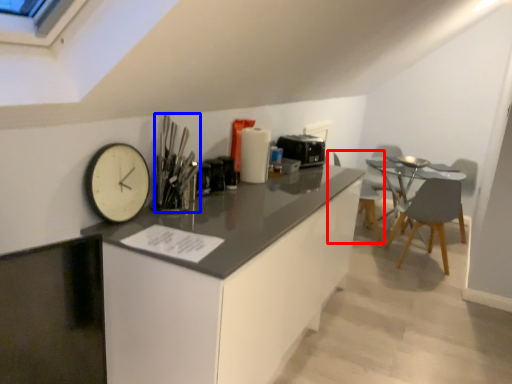
Question: Which object is further to the camera taking this photo, chair (highlighted by a red box) or silverware (highlighted by a blue box)?

Choices:
 (A) chair
 (B) silverware

Answer: (A)